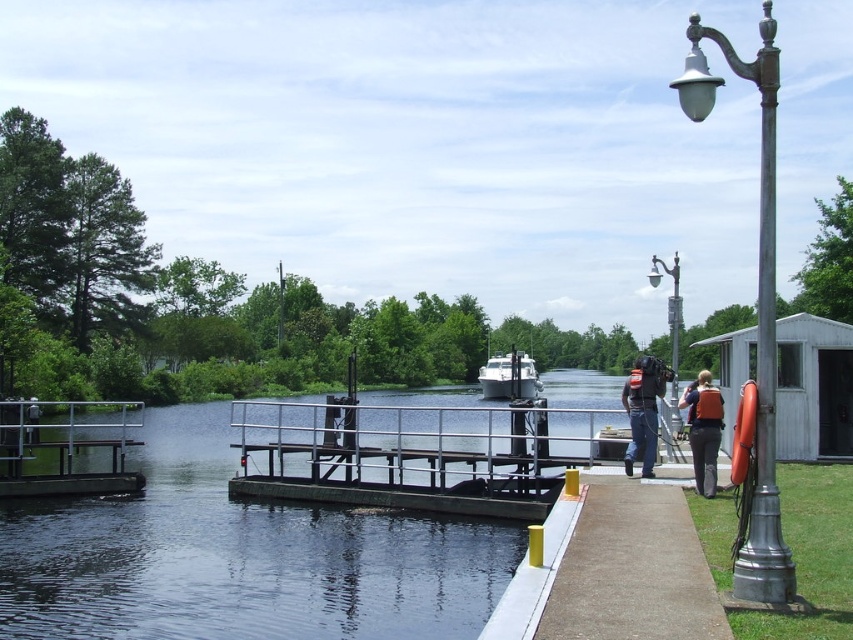
Question: Is bronze metallic lamp post at right further to camera compared to orange fabric life jacket at right?

Choices:
 (A) no
 (B) yes

Answer: (A)

Question: Can you confirm if metallic gray streetlight at upper right is smaller than orange fabric life jacket at right?

Choices:
 (A) no
 (B) yes

Answer: (A)

Question: Which point appears farthest from the camera in this image?

Choices:
 (A) (764, 552)
 (B) (631, 394)
 (C) (650, 284)

Answer: (C)

Question: Estimate the real-world distances between objects in this image. Which object is farther from the metallic gray streetlight at upper right?

Choices:
 (A) bronze metallic lamp post at right
 (B) orange life vest at center
 (C) orange fabric life jacket at right
 (D) orange life vest at right

Answer: (D)

Question: Is bronze metallic lamp post at right positioned at the back of white glossy boat at center?

Choices:
 (A) no
 (B) yes

Answer: (A)

Question: Which object appears closest to the camera in this image?

Choices:
 (A) white glossy boat at center
 (B) bronze metallic lamp post at right
 (C) orange life vest at center

Answer: (B)